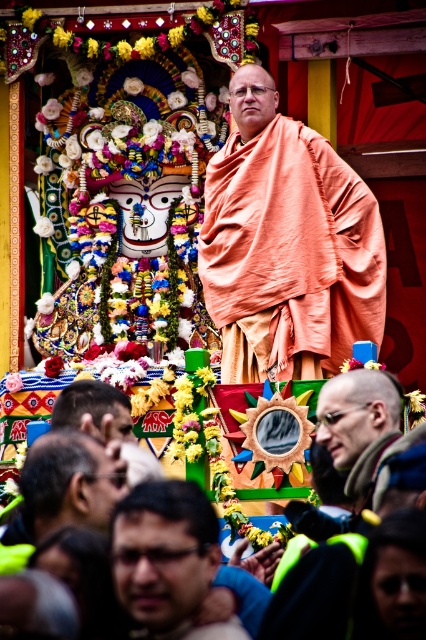
Can you confirm if matte orange robe at center is taller than brown hair at lower left?

Yes, matte orange robe at center is taller than brown hair at lower left.

Does matte orange robe at center lie in front of brown hair at lower left?

Yes, it is in front of brown hair at lower left.

You are a GUI agent. You are given a task and a screenshot of the screen. Output one action in this format:
    pyautogui.click(x=<x>, y=<y>)
    Task: Click on the matte orange robe at center
    The height and width of the screenshot is (640, 426).
    Given the screenshot: What is the action you would take?
    167,557

You are a GUI agent. You are given a task and a screenshot of the screen. Output one action in this format:
    pyautogui.click(x=<x>, y=<y>)
    Task: Click on the matte orange robe at center
    
    Given the screenshot: What is the action you would take?
    pyautogui.click(x=167, y=557)

Does bald head at center appear over brown hair at lower left?

No.

Does bald head at center come behind brown hair at lower left?

No, bald head at center is in front of brown hair at lower left.

Where is `bald head at center`? Image resolution: width=426 pixels, height=640 pixels. bald head at center is located at coordinates (359, 426).

What are the coordinates of `bald head at center` in the screenshot? It's located at (359, 426).

Is dark brown hair at lower left positioned behind brown hair at lower left?

That is False.

Can you confirm if dark brown hair at lower left is positioned to the right of brown hair at lower left?

Indeed, dark brown hair at lower left is positioned on the right side of brown hair at lower left.

Is point (32, 444) closer to camera compared to point (54, 410)?

No, (32, 444) is behind (54, 410).

What are the coordinates of `dark brown hair at lower left` in the screenshot? It's located at (69, 483).